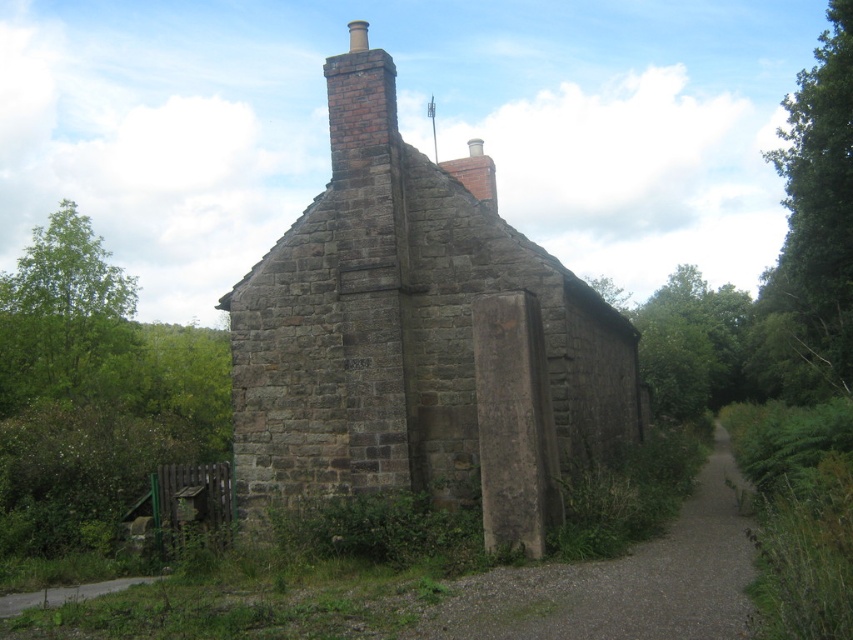
Consider the image. Can you confirm if brown stone cottage at center is wider than dirt/gravel path at lower left?

Yes, brown stone cottage at center is wider than dirt/gravel path at lower left.

Does point (535, 355) come closer to viewer compared to point (86, 595)?

Yes, it is.

I want to click on brown stone cottage at center, so click(419, 337).

Does gravel path at center appear over brown brick chimney at upper center?

Actually, gravel path at center is below brown brick chimney at upper center.

What do you see at coordinates (622, 580) in the screenshot? I see `gravel path at center` at bounding box center [622, 580].

Between point (705, 568) and point (381, 134), which one is positioned behind?

Point (381, 134)

Where is `gravel path at center`? Image resolution: width=853 pixels, height=640 pixels. gravel path at center is located at coordinates (622, 580).

Who is more forward, (345, 81) or (51, 593)?

Point (51, 593) is in front.

You are a GUI agent. You are given a task and a screenshot of the screen. Output one action in this format:
    pyautogui.click(x=<x>, y=<y>)
    Task: Click on the brown brick chimney at upper center
    
    Given the screenshot: What is the action you would take?
    (x=358, y=106)

Locate an element on the screen. brown brick chimney at upper center is located at coordinates (358, 106).

Identify the location of brown brick chimney at upper center. The height and width of the screenshot is (640, 853). coord(358,106).